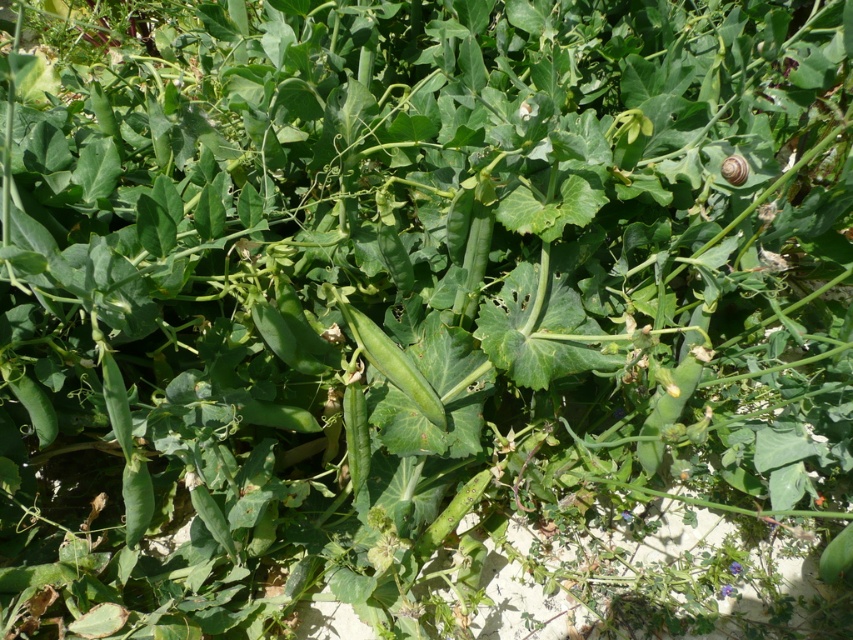
Question: Which point appears closest to the camera in this image?

Choices:
 (A) (416, 385)
 (B) (746, 166)

Answer: (B)

Question: Is green matte pod at center below satin brown snail at upper right?

Choices:
 (A) no
 (B) yes

Answer: (B)

Question: Does green matte pod at center have a lesser width compared to satin brown snail at upper right?

Choices:
 (A) yes
 (B) no

Answer: (B)

Question: Can you confirm if green matte pod at center is thinner than satin brown snail at upper right?

Choices:
 (A) yes
 (B) no

Answer: (B)

Question: Which point is farther to the camera?

Choices:
 (A) (729, 157)
 (B) (430, 406)

Answer: (B)